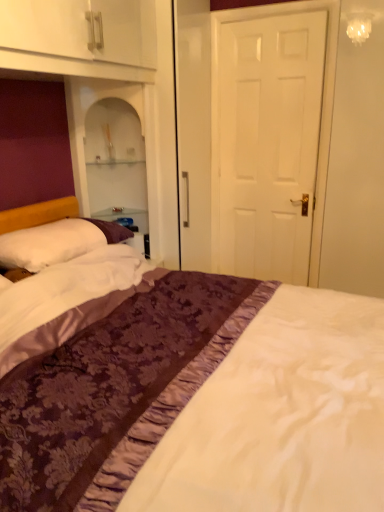
Describe the element at coordinates (276, 122) in the screenshot. The image size is (384, 512). I see `white matte door at center` at that location.

The height and width of the screenshot is (512, 384). What do you see at coordinates (55, 242) in the screenshot?
I see `white soft pillow at left` at bounding box center [55, 242].

The image size is (384, 512). In order to click on white soft pillow at left in this screenshot , I will do `click(55, 242)`.

Where is `purple satin bed at center`? purple satin bed at center is located at coordinates (187, 392).

Locate an element on the screen. white matte door at center is located at coordinates (276, 122).

Considering the points (294, 17) and (267, 429), which point is behind, point (294, 17) or point (267, 429)?

The point (294, 17) is farther from the camera.

Between white matte door at center and purple satin bed at center, which one has larger width?

purple satin bed at center is wider.

Considering the sizes of objects white matte door at center and purple satin bed at center in the image provided, who is bigger, white matte door at center or purple satin bed at center?

With larger size is purple satin bed at center.

Would you say white matte door at center is outside purple satin bed at center?

Yes, white matte door at center is located beyond the bounds of purple satin bed at center.

From the picture: From a real-world perspective, is purple satin bed at center physically below white matte door at center?

Yes, from a real-world perspective, purple satin bed at center is below white matte door at center.

From the image's perspective, is purple satin bed at center located beneath white matte door at center?

Yes, from the image's perspective, purple satin bed at center is beneath white matte door at center.

Identify the location of door located behind the purple satin bed at center. (276, 122).

Can you confirm if purple satin bed at center is positioned to the left of white matte door at center?

Yes, purple satin bed at center is to the left of white matte door at center.

Is white matte door at center looking in the opposite direction of white soft pillow at left?

No, white matte door at center is not facing away from white soft pillow at left.

Considering the positions of objects white matte door at center and white soft pillow at left in the image provided, who is more to the right, white matte door at center or white soft pillow at left?

Positioned to the right is white matte door at center.

Is white matte door at center not close to white soft pillow at left?

Yes, white matte door at center and white soft pillow at left are located far from each other.

Which is more distant, (248,198) or (24,231)?

The point (248,198) is farther from the camera.

The width and height of the screenshot is (384, 512). In order to click on pillow beneath the white matte door at center (from a real-world perspective) in this screenshot , I will do coord(55,242).

Looking at this image, which is behind, white soft pillow at left or white matte door at center?

white matte door at center is further away from the camera.

Can you see white soft pillow at left touching white matte door at center?

No, white soft pillow at left is not next to white matte door at center.

Do you think white soft pillow at left is within purple satin bed at center, or outside of it?

white soft pillow at left is located inside purple satin bed at center.

Considering the sizes of objects white soft pillow at left and purple satin bed at center in the image provided, who is taller, white soft pillow at left or purple satin bed at center?

purple satin bed at center is taller.

Could you tell me if white soft pillow at left is facing purple satin bed at center?

Yes, white soft pillow at left is turned towards purple satin bed at center.

Does purple satin bed at center have a lesser width compared to white soft pillow at left?

In fact, purple satin bed at center might be wider than white soft pillow at left.

How different are the orientations of purple satin bed at center and white soft pillow at left in degrees?

The angle between the facing direction of purple satin bed at center and the facing direction of white soft pillow at left is 0.685 degrees.

Which is behind, purple satin bed at center or white soft pillow at left?

white soft pillow at left.

Is purple satin bed at center next to white soft pillow at left and touching it?

There is a gap between purple satin bed at center and white soft pillow at left.

Identify the location of bed in front of the white matte door at center. (187, 392).

The width and height of the screenshot is (384, 512). Find the location of `door that is above the purple satin bed at center (from the image's perspective)`. door that is above the purple satin bed at center (from the image's perspective) is located at coordinates (276, 122).

Estimate the real-world distances between objects in this image. Which object is further from white matte door at center, white soft pillow at left or purple satin bed at center?

purple satin bed at center is positioned further to the anchor white matte door at center.

Looking at the image, which one is located closer to white soft pillow at left, purple satin bed at center or white matte door at center?

Based on the image, purple satin bed at center appears to be nearer to white soft pillow at left.

From the image, which object appears to be nearer to white matte door at center, purple satin bed at center or white soft pillow at left?

white soft pillow at left.

Consider the image. Looking at the image, which one is located closer to purple satin bed at center, white soft pillow at left or white matte door at center?

white soft pillow at left lies closer to purple satin bed at center than the other object.

Which object lies further to the anchor point white soft pillow at left, white matte door at center or purple satin bed at center?

white matte door at center is further to white soft pillow at left.

From the image, which object appears to be farther from purple satin bed at center, white matte door at center or white soft pillow at left?

The object further to purple satin bed at center is white matte door at center.

The width and height of the screenshot is (384, 512). Identify the location of pillow between purple satin bed at center and white matte door at center in the front-back direction. (55, 242).